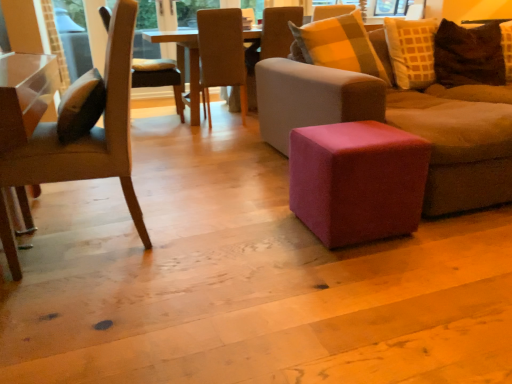
Find the location of `vacant region in front of matte brown chair at left, the first chair when ordered from front to back`. vacant region in front of matte brown chair at left, the first chair when ordered from front to back is located at coordinates (120, 300).